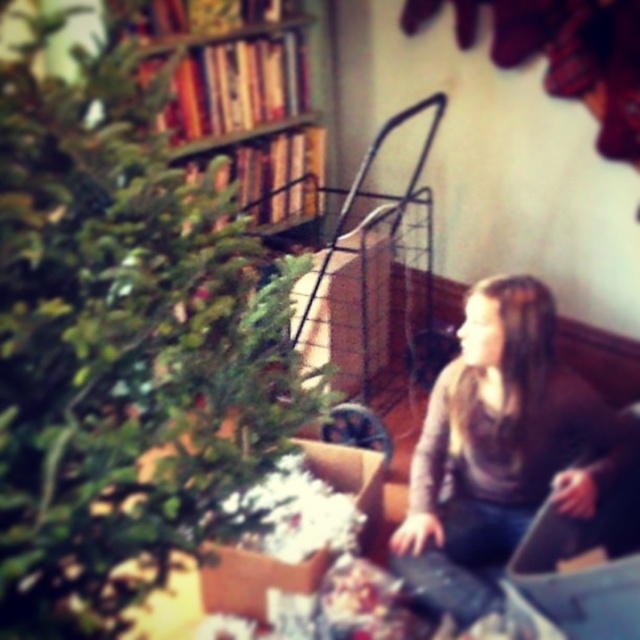
Does matte brown sweater at lower right appear on the left side of wooden bookshelf at upper center?

In fact, matte brown sweater at lower right is to the right of wooden bookshelf at upper center.

Is matte brown sweater at lower right above wooden bookshelf at upper center?

No, matte brown sweater at lower right is not above wooden bookshelf at upper center.

Does point (500, 284) lie behind point (225, 81)?

No, (500, 284) is in front of (225, 81).

This screenshot has width=640, height=640. What are the coordinates of `matte brown sweater at lower right` in the screenshot? It's located at (508, 424).

Is point (97, 328) closer to camera compared to point (262, 77)?

Yes, it is.

Which is behind, point (173, 243) or point (196, 120)?

Positioned behind is point (196, 120).

Which is behind, point (92, 272) or point (221, 108)?

The point (221, 108) is behind.

Identify the location of green matte christmas tree at left. The image size is (640, 640). (122, 348).

Does green matte christmas tree at left come in front of matte brown sweater at lower right?

Yes, it is in front of matte brown sweater at lower right.

Identify the location of green matte christmas tree at left. (122, 348).